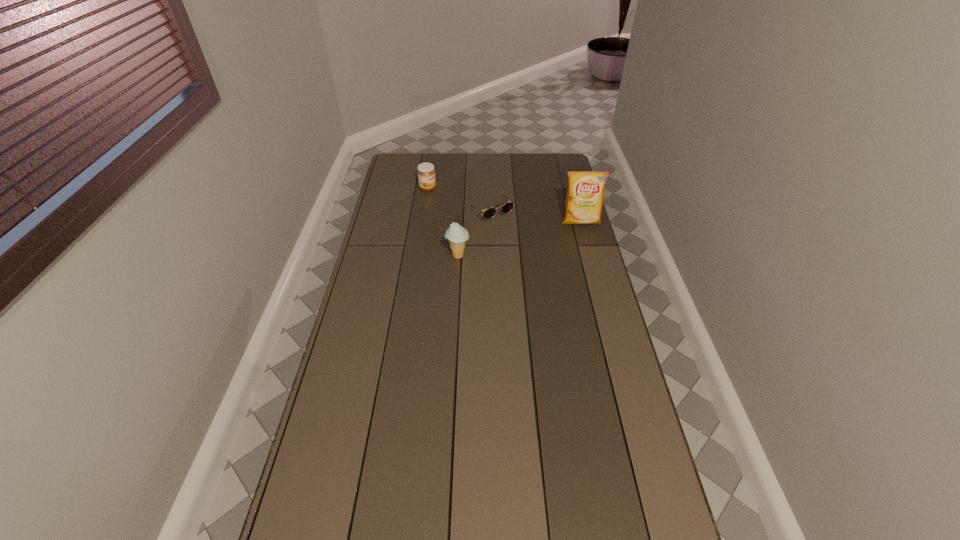
Image resolution: width=960 pixels, height=540 pixels. What are the coordinates of `vacant space at the far left corner of the desktop` in the screenshot? It's located at (424, 156).

The image size is (960, 540). In the image, there is a desktop. What are the coordinates of `blank space at the far right corner` in the screenshot? It's located at (543, 159).

In the image, there is a desktop. At what (x,y) coordinates should I click in order to perform the action: click on free region at the near right corner. Please return your answer as a coordinate pair (x, y). Looking at the image, I should click on (642, 506).

The width and height of the screenshot is (960, 540). What are the coordinates of `vacant area that lies between the sunglasses and the leftmost object` in the screenshot? It's located at (459, 200).

In order to click on free space between the crisp (potato chip) and the sunglasses in this screenshot , I will do `click(536, 217)`.

This screenshot has height=540, width=960. I want to click on empty location between the farthest object and the icecream, so click(x=443, y=222).

I want to click on free space between the shortest object and the nearest object, so click(x=474, y=234).

Find the location of a particular element. The image size is (960, 540). free space between the farthest object and the sunglasses is located at coordinates (459, 200).

At what (x,y) coordinates should I click in order to perform the action: click on vacant area between the tallest object and the icecream. Please return your answer as a coordinate pair (x, y). The height and width of the screenshot is (540, 960). Looking at the image, I should click on (519, 239).

You are a GUI agent. You are given a task and a screenshot of the screen. Output one action in this format:
    pyautogui.click(x=<x>, y=<y>)
    Task: Click on the free point between the third tallest object and the sunglasses
    This screenshot has width=960, height=540.
    Given the screenshot: What is the action you would take?
    pyautogui.click(x=459, y=200)